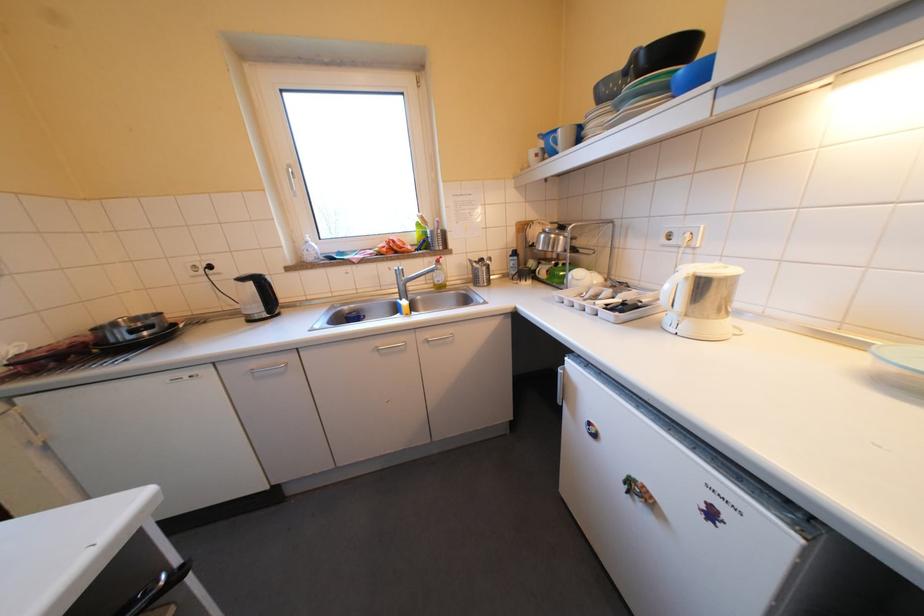
Find where to turn the faucet handle. Please return your answer as a coordinate pair (x, y).

(398, 268)